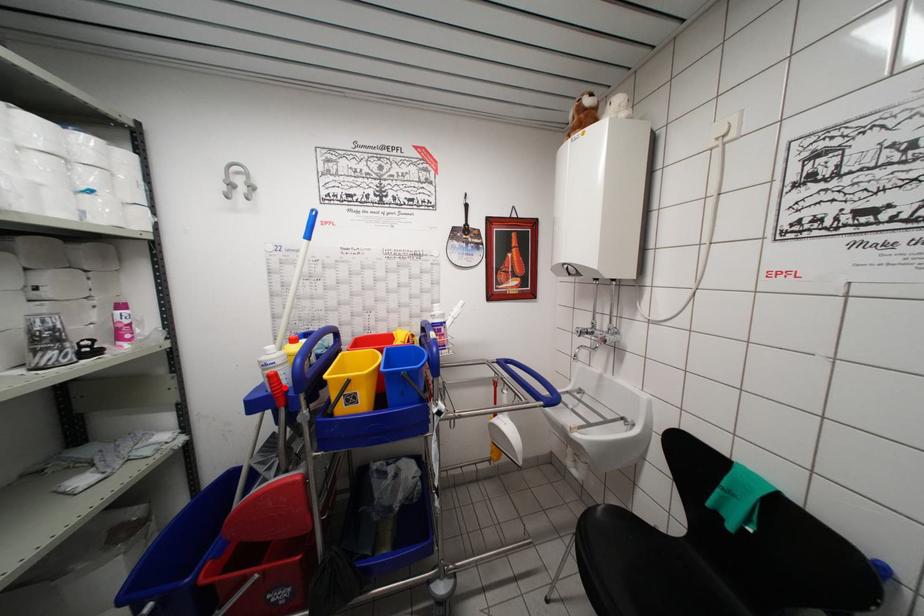
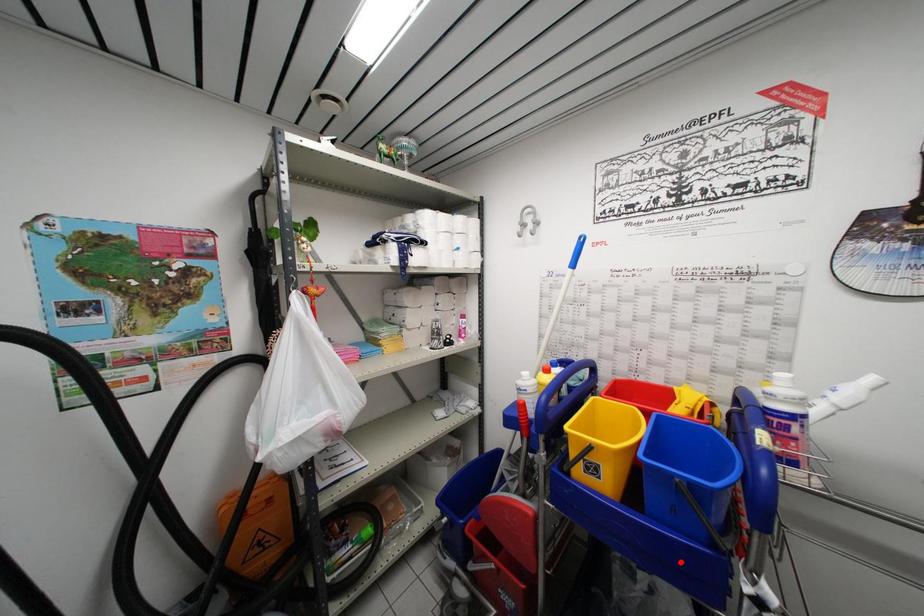
I am providing you with two images of the same scene from different viewpoints. A red point is marked on the first image and another point is marked on the second image. Do the highlighted points in image1 and image2 indicate the same real-world spot?

No